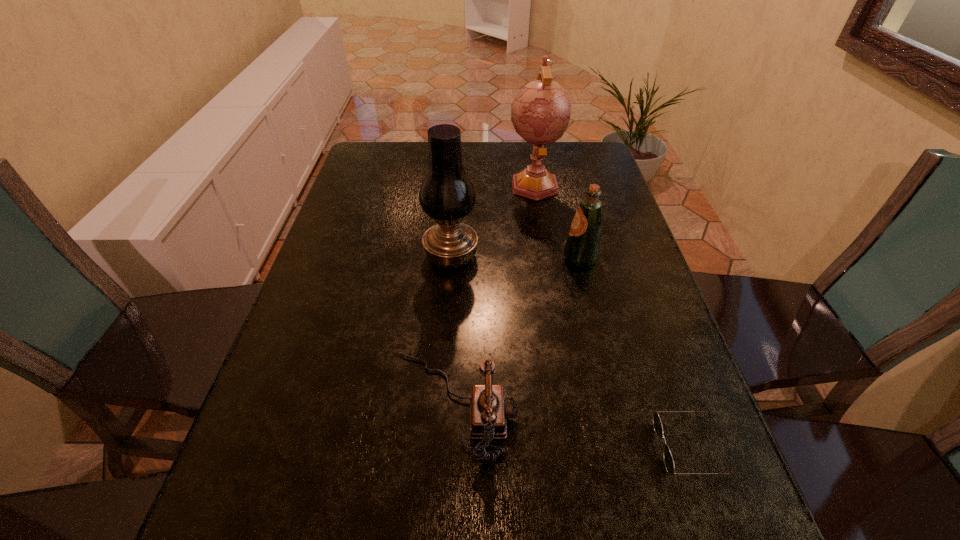
You are a GUI agent. You are given a task and a screenshot of the screen. Output one action in this format:
    pyautogui.click(x=<x>, y=<y>)
    Task: Click on the globe
    Image resolution: width=960 pixels, height=540 pixels.
    Given the screenshot: What is the action you would take?
    pyautogui.click(x=540, y=112)

The image size is (960, 540). I want to click on oil lamp, so [x=447, y=195].

What are the coordinates of `olive oil` in the screenshot? It's located at (582, 248).

Where is `the second shortest object`? the second shortest object is located at coordinates (489, 409).

Locate an element on the screen. The height and width of the screenshot is (540, 960). sunglasses is located at coordinates (657, 425).

You are a GUI agent. You are given a task and a screenshot of the screen. Output one action in this format:
    pyautogui.click(x=<x>, y=<y>)
    Task: Click on the shortest object
    The height and width of the screenshot is (540, 960).
    Given the screenshot: What is the action you would take?
    pyautogui.click(x=657, y=425)

You are a GUI agent. You are given a task and a screenshot of the screen. Output one action in this format:
    pyautogui.click(x=<x>, y=<y>)
    Task: Click on the vacant region located 0.320m on the front-facing side of the globe
    This screenshot has width=960, height=540.
    Given the screenshot: What is the action you would take?
    pyautogui.click(x=550, y=281)

I want to click on blank space located on the left of the oil lamp, so click(x=343, y=256).

You are a GUI agent. You are given a task and a screenshot of the screen. Output one action in this format:
    pyautogui.click(x=<x>, y=<y>)
    Task: Click on the vacant space located on the front-facing side of the olive oil
    Image resolution: width=960 pixels, height=540 pixels.
    Given the screenshot: What is the action you would take?
    pyautogui.click(x=434, y=258)

Where is `free space located 0.350m on the front-facing side of the olive oil`? Image resolution: width=960 pixels, height=540 pixels. free space located 0.350m on the front-facing side of the olive oil is located at coordinates (426, 258).